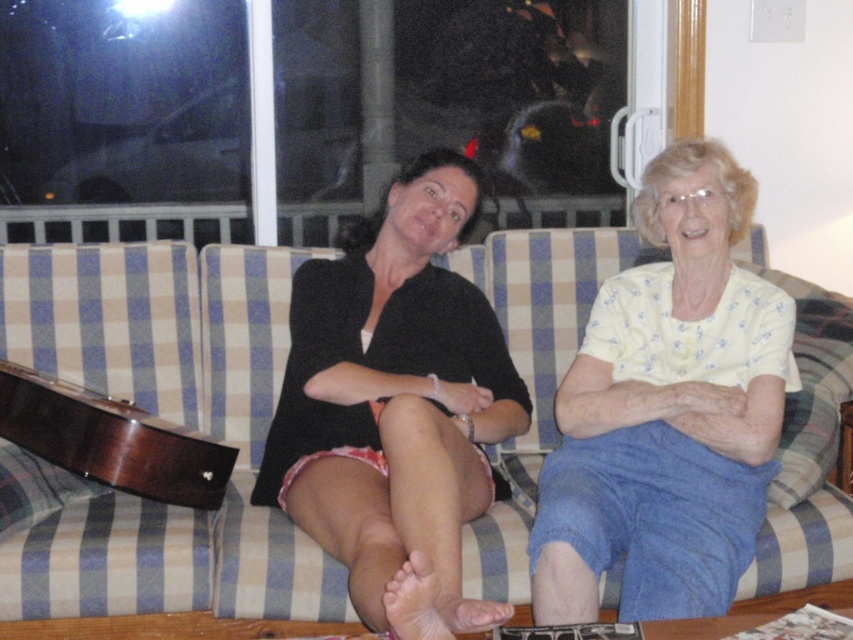
Question: Is light yellow printed blouse at center positioned behind light yellow floral blouse at center?

Choices:
 (A) yes
 (B) no

Answer: (A)

Question: Which is nearer to the blue plaid couch at center?

Choices:
 (A) dark wood guitar at lower left
 (B) light yellow floral blouse at center
 (C) light yellow printed blouse at center

Answer: (A)

Question: Which point is farther to the camera?

Choices:
 (A) (711, 595)
 (B) (813, 292)
 (C) (190, 500)
 (D) (347, 554)

Answer: (B)

Question: Is light yellow printed blouse at center below light yellow floral blouse at center?

Choices:
 (A) yes
 (B) no

Answer: (B)

Question: Which of the following is the farthest from the observer?

Choices:
 (A) (78, 518)
 (B) (643, 208)

Answer: (B)

Question: Does light yellow printed blouse at center appear under light yellow floral blouse at center?

Choices:
 (A) no
 (B) yes

Answer: (A)